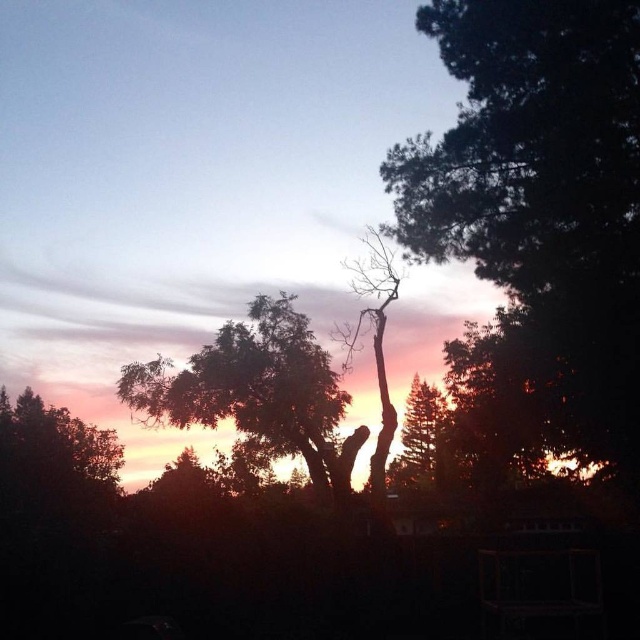
Question: Which of the following is the closest to the observer?

Choices:
 (A) smooth bark tree at center
 (B) dark green textured tree at right
 (C) silhouette bare tree at center

Answer: (B)

Question: Which point is farther to the camera?

Choices:
 (A) silhouette bare tree at center
 (B) green leafy tree at center

Answer: (B)

Question: Can you confirm if dark green textured tree at right is positioned above smooth bark tree at center?

Choices:
 (A) yes
 (B) no

Answer: (A)

Question: Can you confirm if dark green textured tree at right is positioned above green leafy tree at center?

Choices:
 (A) yes
 (B) no

Answer: (B)

Question: Can you confirm if green leafy tree at center is positioned above silhouette bare tree at center?

Choices:
 (A) no
 (B) yes

Answer: (B)

Question: Which point is closer to the camera?

Choices:
 (A) smooth bark tree at center
 (B) silhouette bare tree at center
 (C) green leafy tree at center

Answer: (B)